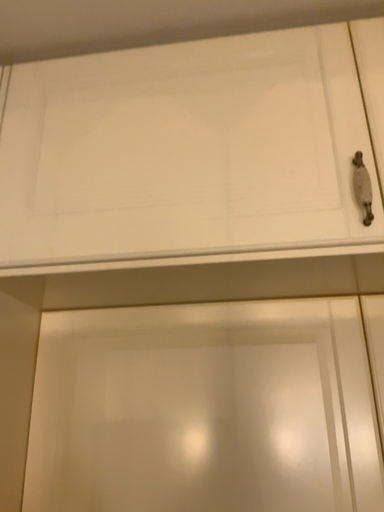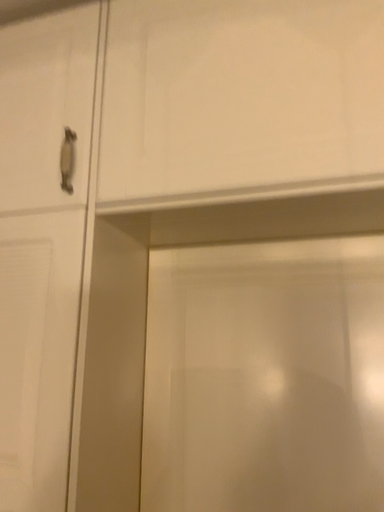
Question: Which way did the camera rotate in the video?

Choices:
 (A) rotated right
 (B) rotated left

Answer: (B)